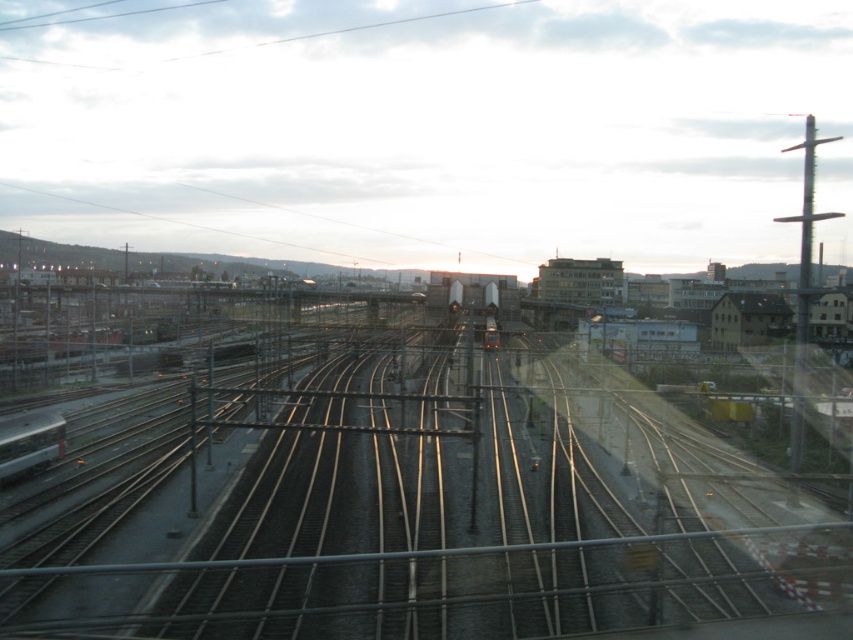
Question: Can you confirm if silver metallic train at left is positioned to the left of metallic silver train at lower left?

Choices:
 (A) no
 (B) yes

Answer: (B)

Question: Estimate the real-world distances between objects in this image. Which object is farther from the metal tracks at center?

Choices:
 (A) silver metallic train at left
 (B) metallic silver train at lower left

Answer: (B)

Question: From the image, what is the correct spatial relationship of silver metallic train at left in relation to metallic silver train at center?

Choices:
 (A) right
 (B) left

Answer: (B)

Question: Does metal tracks at center have a larger size compared to metallic silver train at center?

Choices:
 (A) no
 (B) yes

Answer: (B)

Question: Based on their relative distances, which object is farther from the metallic silver train at lower left?

Choices:
 (A) metal tracks at center
 (B) metallic silver train at center

Answer: (B)

Question: Based on their relative distances, which object is nearer to the silver metallic train at left?

Choices:
 (A) metal tracks at center
 (B) metallic silver train at center
 (C) metallic silver train at lower left

Answer: (C)